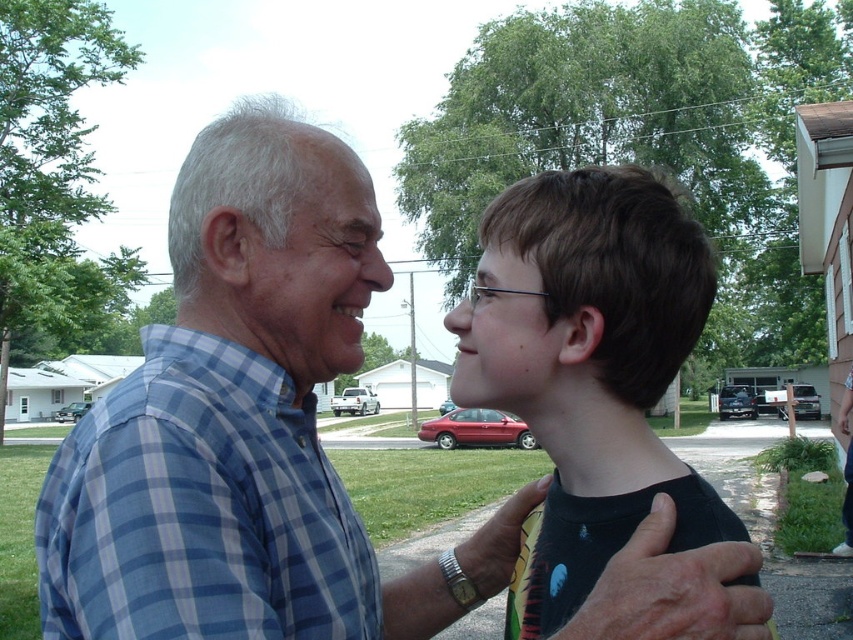
Does point (62, 556) come farther from viewer compared to point (566, 368)?

That is False.

In the scene shown: Can you confirm if blue plaid shirt at left is thinner than black matte shirt at center?

In fact, blue plaid shirt at left might be wider than black matte shirt at center.

This screenshot has width=853, height=640. Describe the element at coordinates (200, 509) in the screenshot. I see `blue plaid shirt at left` at that location.

This screenshot has width=853, height=640. What are the coordinates of `blue plaid shirt at left` in the screenshot? It's located at (200, 509).

Based on the photo, is blue plaid shirt at center bigger than black matte shirt at center?

Indeed, blue plaid shirt at center has a larger size compared to black matte shirt at center.

Does blue plaid shirt at center appear on the right side of black matte shirt at center?

Incorrect, blue plaid shirt at center is not on the right side of black matte shirt at center.

Is point (238, 568) positioned before point (460, 371)?

That is True.

Identify the location of blue plaid shirt at center. (244, 424).

Is blue plaid shirt at center thinner than blue plaid shirt at left?

No.

Measure the distance between point (358, 352) and camera.

A distance of 3.81 feet exists between point (358, 352) and camera.

Image resolution: width=853 pixels, height=640 pixels. Find the location of `blue plaid shirt at center`. blue plaid shirt at center is located at coordinates (244, 424).